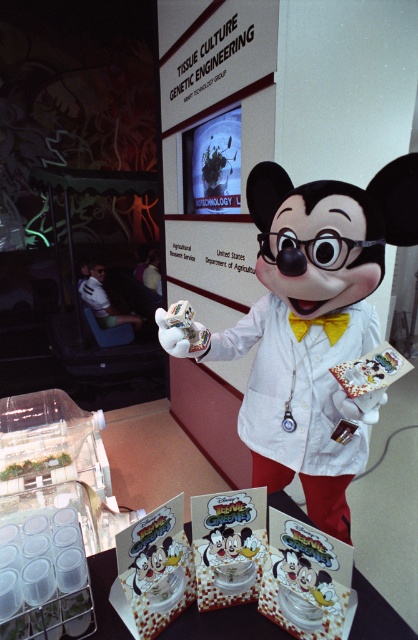
Question: Which object is closer to the camera taking this photo?

Choices:
 (A) white glossy mickey mouse at center
 (B) white glossy plush at center

Answer: (A)

Question: Can you confirm if white glossy mickey mouse at center is smaller than white glossy plush at center?

Choices:
 (A) no
 (B) yes

Answer: (A)

Question: Is white glossy mickey mouse at center bigger than white glossy plush at center?

Choices:
 (A) no
 (B) yes

Answer: (B)

Question: Can you confirm if white glossy mickey mouse at center is smaller than white glossy plush at center?

Choices:
 (A) yes
 (B) no

Answer: (B)

Question: Among these points, which one is nearest to the camera?

Choices:
 (A) (188, 352)
 (B) (402, 166)

Answer: (A)